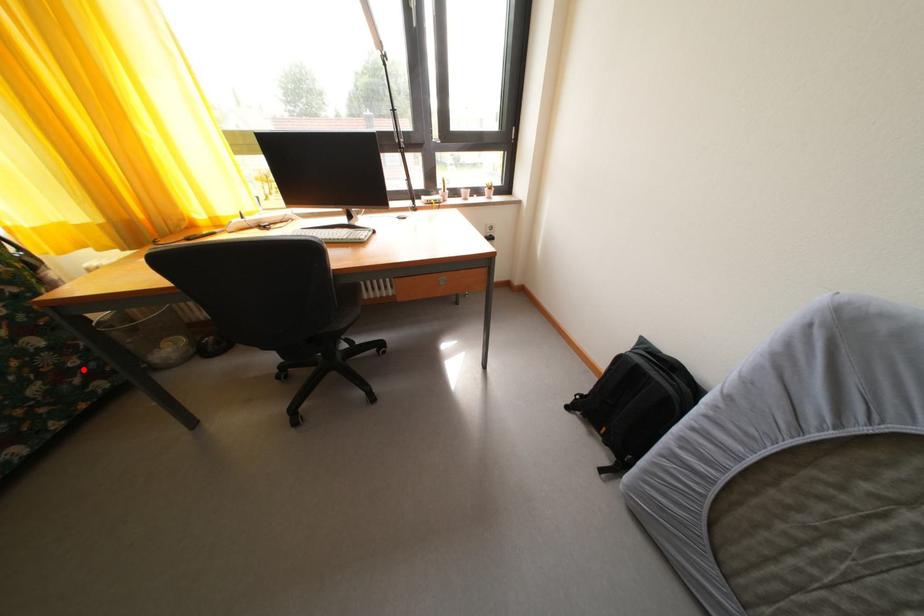
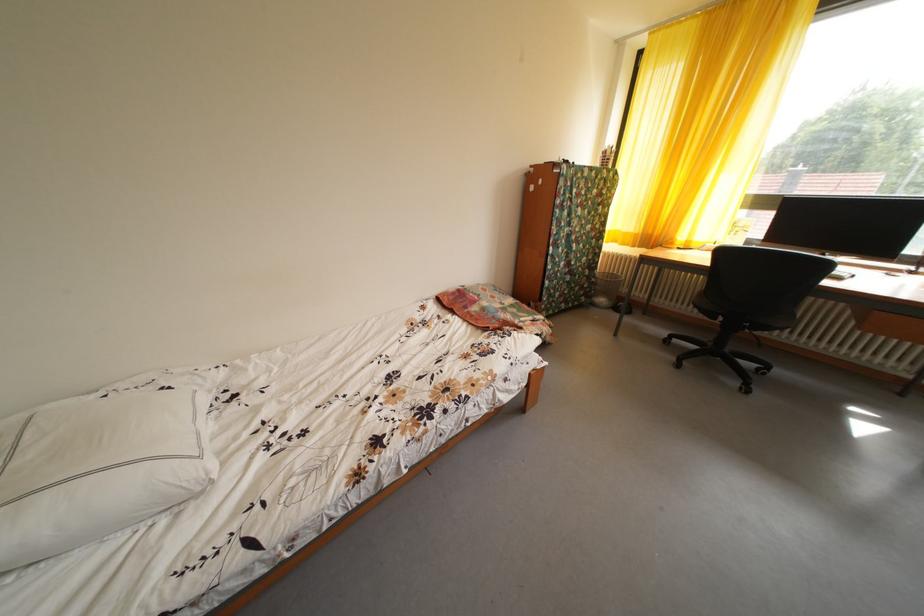
Find the pixel in the second image that matches the highlighted location in the first image.

(594, 292)